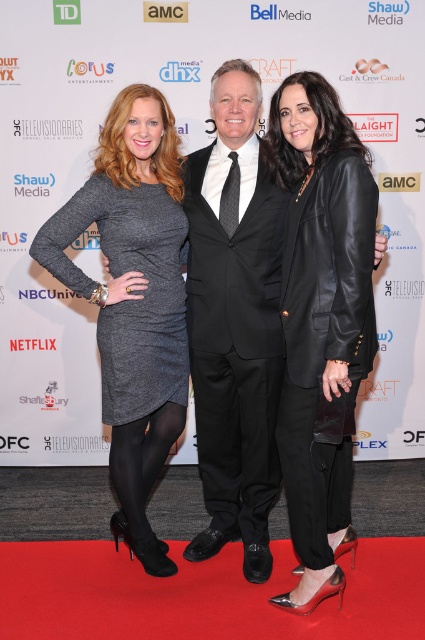
Question: Observing the image, what is the correct spatial positioning of black leather blazer at center in reference to gray knit dress at left?

Choices:
 (A) right
 (B) left

Answer: (A)

Question: Which of these objects is positioned farthest from the black leather blazer at center?

Choices:
 (A) gray knit dress at left
 (B) black satin suit at center

Answer: (A)

Question: Considering the real-world distances, which object is farthest from the gray knit dress at left?

Choices:
 (A) black leather blazer at center
 (B) black satin suit at center

Answer: (A)

Question: Is black leather blazer at center below gray knit dress at left?

Choices:
 (A) yes
 (B) no

Answer: (A)

Question: Which object appears farthest from the camera in this image?

Choices:
 (A) black leather blazer at center
 (B) gray knit dress at left

Answer: (B)

Question: Is black leather blazer at center to the right of black satin suit at center from the viewer's perspective?

Choices:
 (A) no
 (B) yes

Answer: (B)